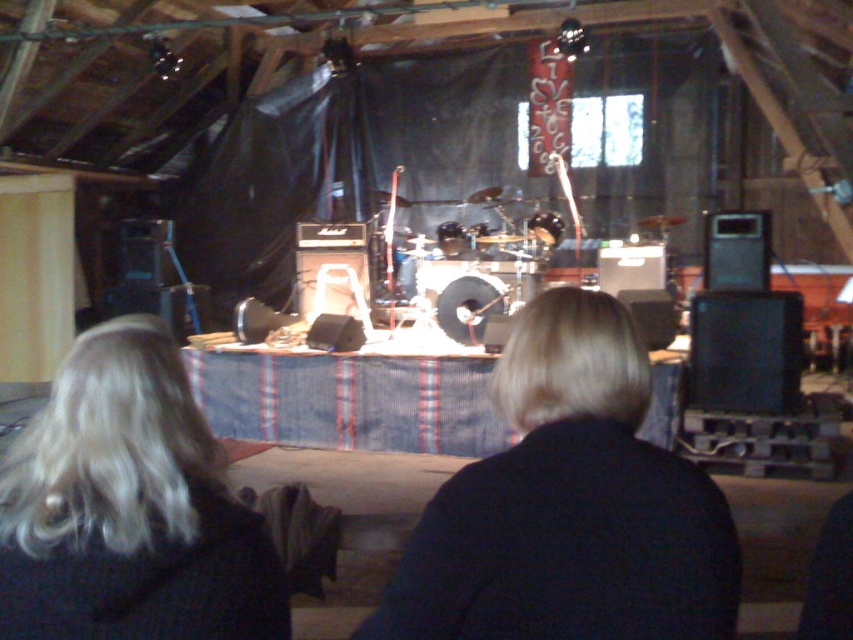
Question: Which point is closer to the camera taking this photo?

Choices:
 (A) (489, 596)
 (B) (273, 586)

Answer: (A)

Question: Can you confirm if blonde hair at center is positioned to the right of blonde hair at lower left?

Choices:
 (A) yes
 (B) no

Answer: (A)

Question: Which point appears closest to the camera in this image?

Choices:
 (A) (454, 637)
 (B) (107, 628)

Answer: (A)

Question: Can you confirm if blonde hair at center is positioned above blonde hair at lower left?

Choices:
 (A) no
 (B) yes

Answer: (B)

Question: Can you confirm if blonde hair at center is positioned to the right of blonde hair at lower left?

Choices:
 (A) no
 (B) yes

Answer: (B)